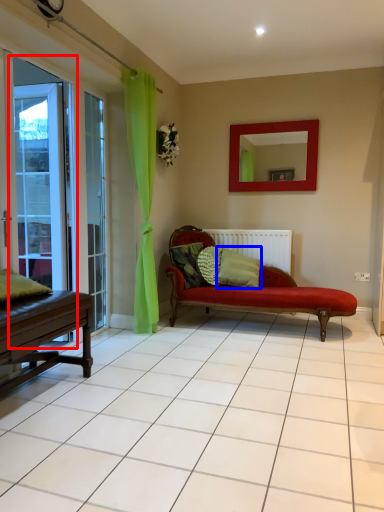
Question: Which object is further to the camera taking this photo, screen door (highlighted by a red box) or pillow (highlighted by a blue box)?

Choices:
 (A) screen door
 (B) pillow

Answer: (B)